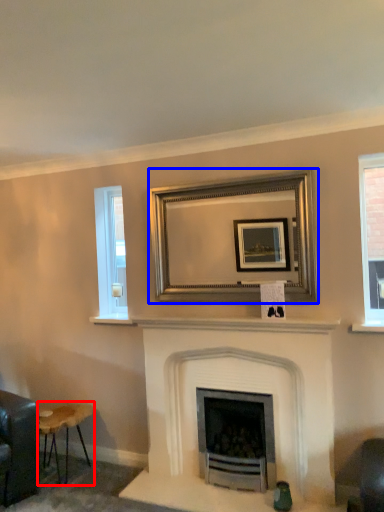
Question: Among these objects, which one is farthest to the camera, stool (highlighted by a red box) or picture frame (highlighted by a blue box)?

Choices:
 (A) stool
 (B) picture frame

Answer: (A)